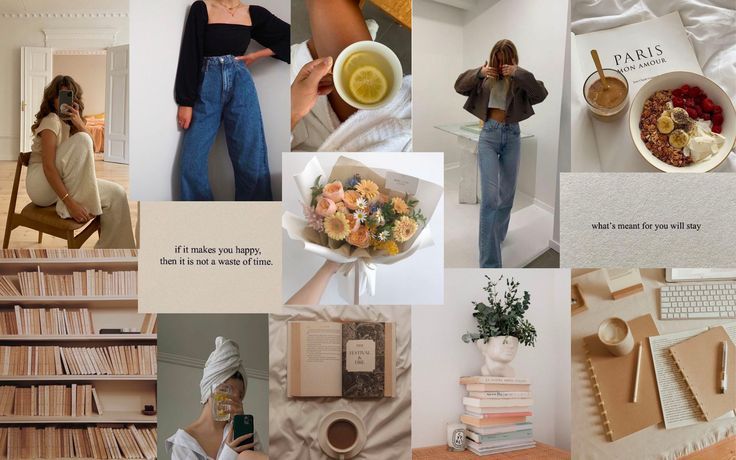
You are a GUI agent. You are given a task and a screenshot of the screen. Output one action in this format:
    pyautogui.click(x=<x>, y=<y>)
    Task: Click on the shelves holding books
    Image resolution: width=736 pixels, height=460 pixels.
    Given the screenshot: What is the action you would take?
    pyautogui.click(x=92, y=263), pyautogui.click(x=88, y=301), pyautogui.click(x=82, y=340), pyautogui.click(x=73, y=377), pyautogui.click(x=73, y=416)